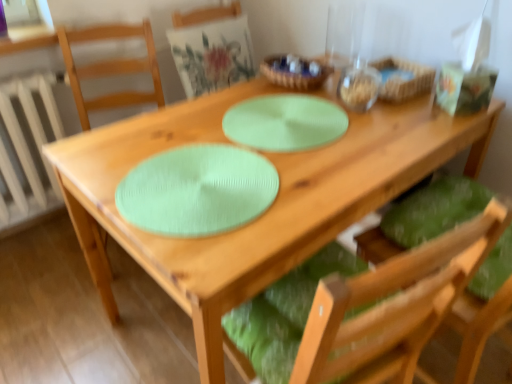
This screenshot has height=384, width=512. Identify the location of empty space that is ontop of green textured placemat at center (from a real-world perspective). (287, 117).